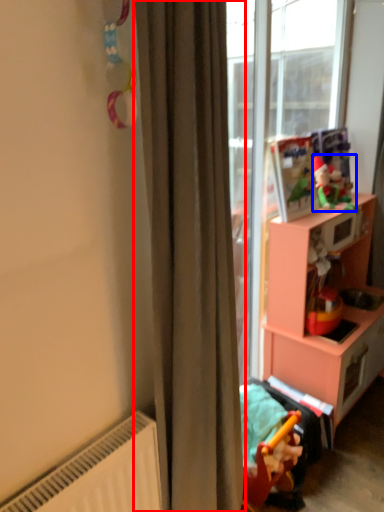
Question: Which point is closer to the camera, curtain (highlighted by a red box) or toy (highlighted by a blue box)?

Choices:
 (A) curtain
 (B) toy

Answer: (A)